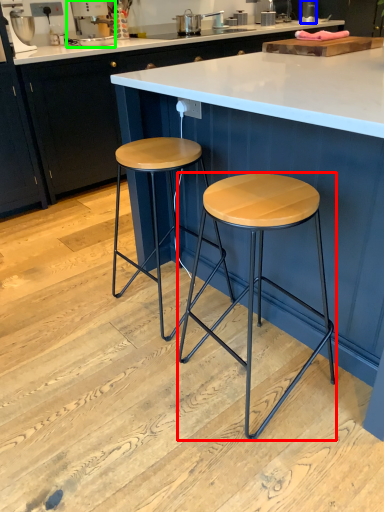
Question: Considering the real-world distances, which object is farthest from stool (highlighted by a red box)? appliance (highlighted by a blue box) or appliance (highlighted by a green box)?

Choices:
 (A) appliance
 (B) appliance

Answer: (A)